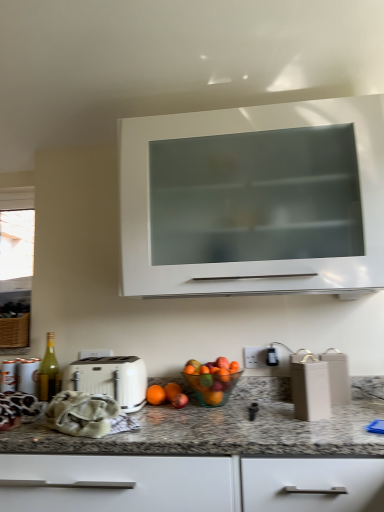
Question: Considering the positions of matte beige container at lower right and orange matte at center in the image, is matte beige container at lower right bigger or smaller than orange matte at center?

Choices:
 (A) small
 (B) big

Answer: (B)

Question: Is matte beige container at lower right situated inside orange matte at center or outside?

Choices:
 (A) outside
 (B) inside

Answer: (A)

Question: Which is farther from the white matte toaster at center?

Choices:
 (A) red matte apple at center
 (B) transparent glass window at left
 (C) granite at lower center
 (D) green glass bottle at left
 (E) translucent glass bowl at center

Answer: (B)

Question: Which object is positioned farthest from the white glossy cabinet at upper center?

Choices:
 (A) transparent glass window at left
 (B) orange matte at center
 (C) green glass bottle at left
 (D) granite at lower center
 (E) red matte apple at center

Answer: (A)